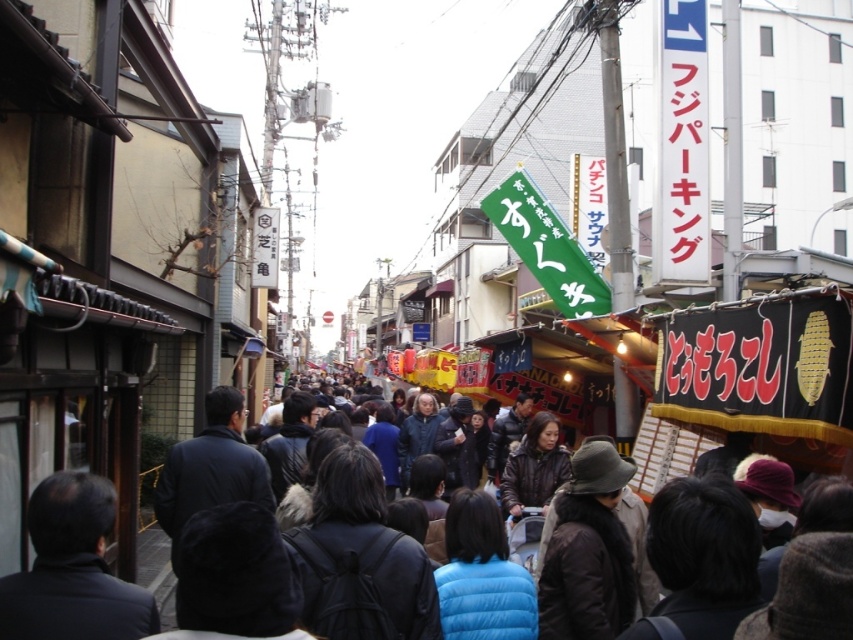
Does white plastic sign at upper right have a lesser height compared to dark brown leather jacket at center?

No.

Where is `white plastic sign at upper right`? white plastic sign at upper right is located at coordinates (682, 147).

Find the location of a particular element. This screenshot has height=640, width=853. white plastic sign at upper right is located at coordinates (682, 147).